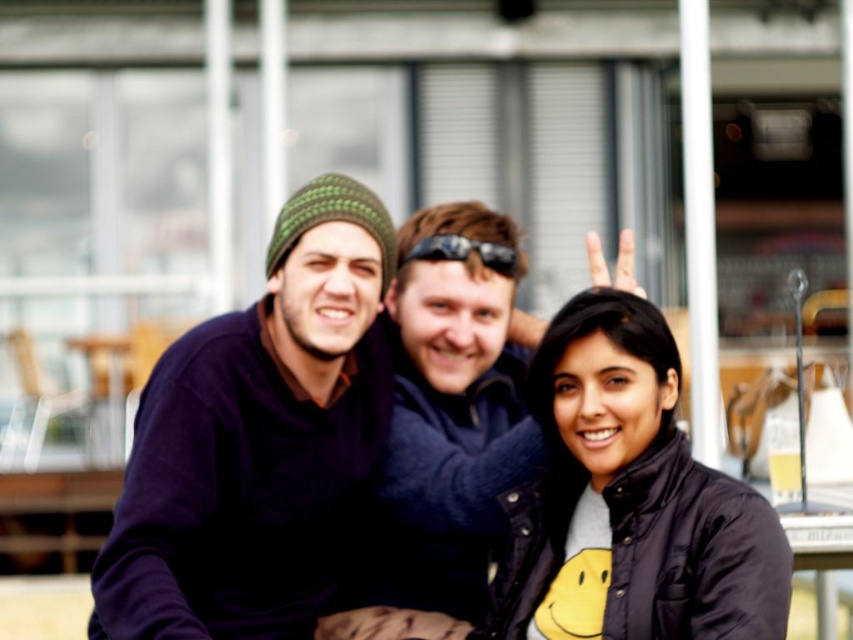
Question: Does matte purple sweater at left come in front of matte black sweater at center?

Choices:
 (A) yes
 (B) no

Answer: (B)

Question: Which point appears closest to the camera in this image?

Choices:
 (A) (515, 264)
 (B) (524, 326)
 (C) (469, 625)
 (D) (583, 449)

Answer: (D)

Question: From the image, what is the correct spatial relationship of matte black sweater at center in relation to black rubber sunglasses at center?

Choices:
 (A) right
 (B) left

Answer: (A)

Question: Which object appears closest to the camera in this image?

Choices:
 (A) dark blue jacket at center
 (B) matte black sweater at center
 (C) matte purple sweater at left
 (D) black rubber sunglasses at center

Answer: (A)

Question: Which object is positioned farthest from the matte purple sweater at left?

Choices:
 (A) dark blue sweater at center
 (B) black rubber sunglasses at center
 (C) dark blue jacket at center
 (D) matte black sweater at center

Answer: (C)

Question: Is dark blue jacket at center to the left of dark blue sweater at center from the viewer's perspective?

Choices:
 (A) no
 (B) yes

Answer: (A)